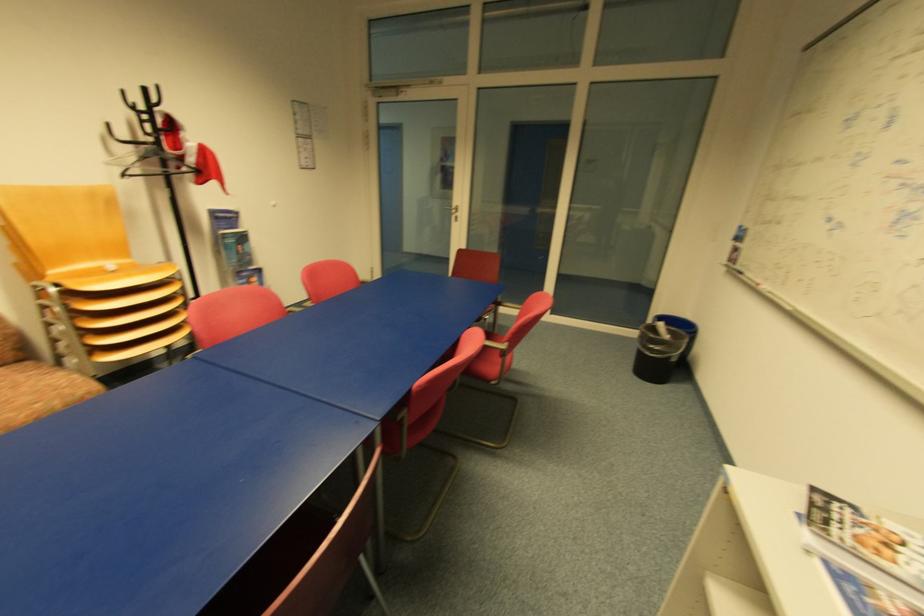
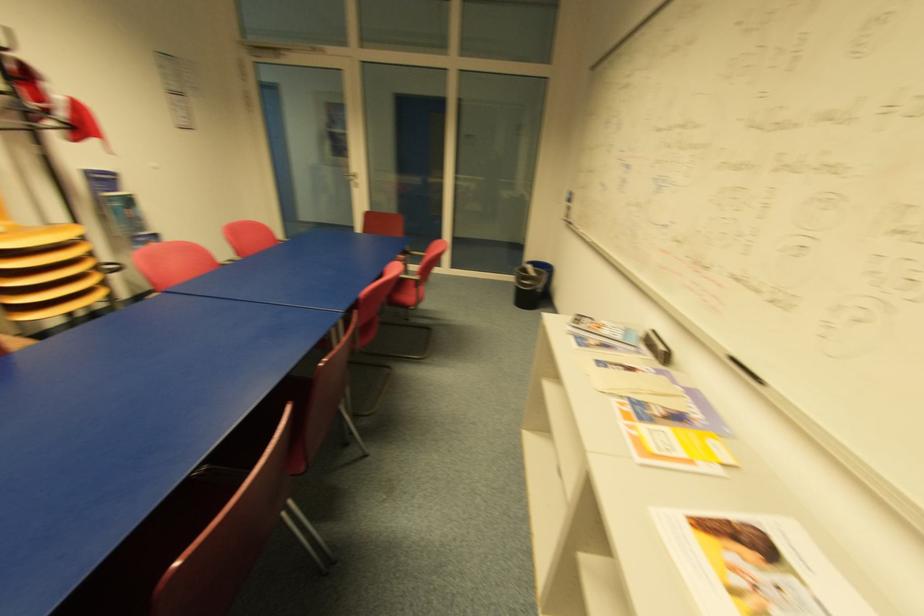
Question: The camera is either moving clockwise (left) or counter-clockwise (right) around the object. The first image is from the beginning of the video and the second image is from the end. Is the camera moving left or right when shooting the video?

Choices:
 (A) Left
 (B) Right

Answer: (A)